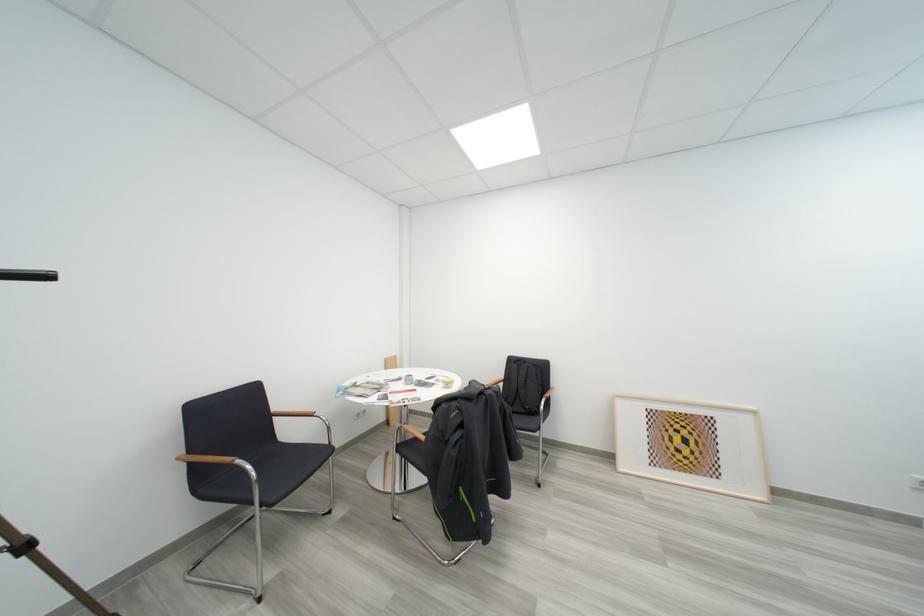
The width and height of the screenshot is (924, 616). I want to click on wooden chair armrest, so click(x=215, y=460).